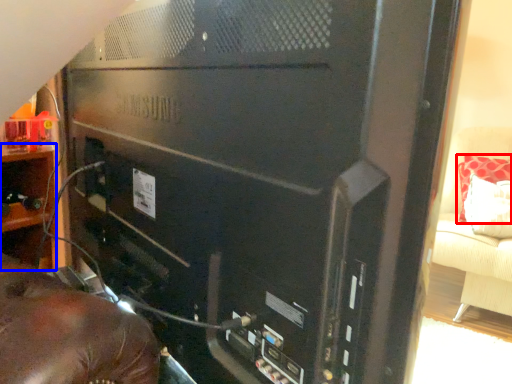
Question: Among these objects, which one is nearest to the camera, pillow (highlighted by a red box) or shelf (highlighted by a blue box)?

Choices:
 (A) pillow
 (B) shelf

Answer: (B)